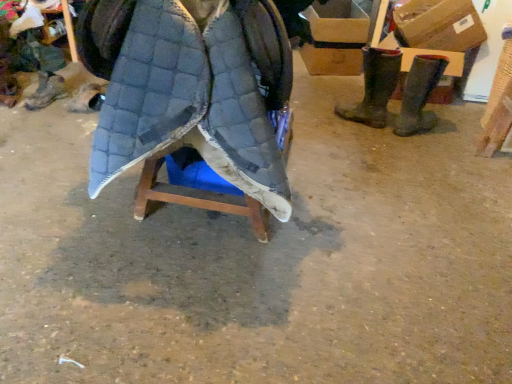
Measure the distance between point (166, 23) and camera.

Answer: Point (166, 23) and camera are 1.09 meters apart.

What are the coordinates of `matte black boot at center, which is the 2th footwear in left-to-right order` in the screenshot? It's located at (87, 98).

What is the approximate width of matte black boot at center, placed as the third footwear when sorted from right to left?

The width of matte black boot at center, placed as the third footwear when sorted from right to left, is 7.79 inches.

Describe the element at coordinates (374, 87) in the screenshot. I see `brown rubber boots at right, the 3th footwear from the left` at that location.

Describe the element at coordinates (419, 95) in the screenshot. The width and height of the screenshot is (512, 384). I see `brown suede boots at right, which ranks as the first footwear in right-to-left order` at that location.

You are a GUI agent. You are given a task and a screenshot of the screen. Output one action in this format:
    pyautogui.click(x=<x>, y=<y>)
    Task: Click on the leather boot at lower left, acting as the 4th footwear starting from the right
    The width and height of the screenshot is (512, 384).
    Given the screenshot: What is the action you would take?
    pyautogui.click(x=46, y=91)

Who is more distant, quilted fabric cloak at center or cardboard box at upper right, the 2th cardboard box from the left?

cardboard box at upper right, the 2th cardboard box from the left, is more distant.

What's the angular difference between quilted fabric cloak at center and cardboard box at upper right, which ranks as the first cardboard box in front-to-back order,'s facing directions?

86 degrees separate the facing orientations of quilted fabric cloak at center and cardboard box at upper right, which ranks as the first cardboard box in front-to-back order.

Does point (247, 161) lie in front of point (454, 38)?

Yes, it is in front of point (454, 38).

Identify the location of cloak located on the left of cardboard box at upper right, which ranks as the first cardboard box in front-to-back order. (191, 88).

Which object is thinner, brown rubber boots at right, the 3th footwear from the left, or brown suede boots at right, which ranks as the first footwear in right-to-left order?

Thinner between the two is brown rubber boots at right, the 3th footwear from the left.

Looking at the image, does brown rubber boots at right, arranged as the second footwear when viewed from the right, seem bigger or smaller compared to brown suede boots at right, which ranks as the first footwear in right-to-left order?

In the image, brown rubber boots at right, arranged as the second footwear when viewed from the right, appears to be larger than brown suede boots at right, which ranks as the first footwear in right-to-left order.

Could you tell me if brown rubber boots at right, the 3th footwear from the left, is facing brown suede boots at right, which ranks as the first footwear in right-to-left order?

No, brown rubber boots at right, the 3th footwear from the left, does not turn towards brown suede boots at right, which ranks as the first footwear in right-to-left order.

Is brown rubber boots at right, arranged as the second footwear when viewed from the right, to the left or to the right of brown suede boots at right, which ranks as the first footwear in right-to-left order, in the image?

In the image, brown rubber boots at right, arranged as the second footwear when viewed from the right, appears on the left side of brown suede boots at right, which ranks as the first footwear in right-to-left order.

Is quilted fabric cloak at center taller than brown suede boots at right, acting as the fourth footwear starting from the left?

Indeed, quilted fabric cloak at center has a greater height compared to brown suede boots at right, acting as the fourth footwear starting from the left.

Is quilted fabric cloak at center positioned behind brown suede boots at right, which ranks as the first footwear in right-to-left order?

No, quilted fabric cloak at center is in front of brown suede boots at right, which ranks as the first footwear in right-to-left order.

From the picture: Between quilted fabric cloak at center and brown suede boots at right, which ranks as the first footwear in right-to-left order, which one has larger width?

With larger width is quilted fabric cloak at center.

Locate an element on the screen. footwear that is the 2nd one when counting leftward from the brown suede boots at right, which ranks as the first footwear in right-to-left order is located at coordinates (87, 98).

Considering the relative sizes of brown suede boots at right, which ranks as the first footwear in right-to-left order, and matte black boot at center, which is the 2th footwear in left-to-right order, in the image provided, is brown suede boots at right, which ranks as the first footwear in right-to-left order, wider than matte black boot at center, which is the 2th footwear in left-to-right order,?

Yes.

Is brown suede boots at right, which ranks as the first footwear in right-to-left order, inside the boundaries of matte black boot at center, which is the 2th footwear in left-to-right order, or outside?

brown suede boots at right, which ranks as the first footwear in right-to-left order, cannot be found inside matte black boot at center, which is the 2th footwear in left-to-right order.

Which object is closer to the camera, brown suede boots at right, acting as the fourth footwear starting from the left, or matte black boot at center, placed as the third footwear when sorted from right to left?

brown suede boots at right, acting as the fourth footwear starting from the left, is closer to the camera.

From a real-world perspective, is cardboard box at upper right, placed as the 2th cardboard box when sorted from back to front, on top of cardboard box at upper right, positioned as the first cardboard box in left-to-right order?

Correct, in the physical world, cardboard box at upper right, placed as the 2th cardboard box when sorted from back to front, is higher than cardboard box at upper right, positioned as the first cardboard box in left-to-right order.

The height and width of the screenshot is (384, 512). What are the coordinates of `cardboard box located below the cardboard box at upper right, positioned as the first cardboard box in left-to-right order (from the image's perspective)` in the screenshot? It's located at (439, 25).

Does point (404, 22) come farther from viewer compared to point (349, 2)?

That is False.

Considering the sizes of objects cardboard box at upper right, which appears as the 1th cardboard box when viewed from the back, and leather boot at lower left, the first footwear from the left, in the image provided, who is thinner, cardboard box at upper right, which appears as the 1th cardboard box when viewed from the back, or leather boot at lower left, the first footwear from the left,?

leather boot at lower left, the first footwear from the left, is thinner.

Considering the sizes of objects cardboard box at upper right, arranged as the second cardboard box when viewed from the front, and leather boot at lower left, acting as the 4th footwear starting from the right, in the image provided, who is shorter, cardboard box at upper right, arranged as the second cardboard box when viewed from the front, or leather boot at lower left, acting as the 4th footwear starting from the right,?

leather boot at lower left, acting as the 4th footwear starting from the right, is shorter.

Choose the correct answer: Is cardboard box at upper right, positioned as the first cardboard box in left-to-right order, inside leather boot at lower left, the first footwear from the left, or outside it?

cardboard box at upper right, positioned as the first cardboard box in left-to-right order, is not enclosed by leather boot at lower left, the first footwear from the left.

Is cardboard box at upper right, which appears as the 1th cardboard box when viewed from the back, far from leather boot at lower left, acting as the 4th footwear starting from the right?

That's right, there is a large distance between cardboard box at upper right, which appears as the 1th cardboard box when viewed from the back, and leather boot at lower left, acting as the 4th footwear starting from the right.

Is quilted fabric cloak at center facing away from brown rubber boots at right, arranged as the second footwear when viewed from the right?

Correct, quilted fabric cloak at center is looking away from brown rubber boots at right, arranged as the second footwear when viewed from the right.

Which is farther, (x=288, y=189) or (x=385, y=82)?

Positioned behind is point (x=385, y=82).

The height and width of the screenshot is (384, 512). Identify the location of cloak on the left of brown rubber boots at right, the 3th footwear from the left. (191, 88).

From a real-world perspective, which object stands above the other?

quilted fabric cloak at center, from a real-world perspective.

In order to click on cloak in front of the cardboard box at upper right, which is counted as the 1th cardboard box, starting from the right in this screenshot , I will do `click(191, 88)`.

You are a GUI agent. You are given a task and a screenshot of the screen. Output one action in this format:
    pyautogui.click(x=<x>, y=<y>)
    Task: Click on the 2nd footwear above the brown suede boots at right, which ranks as the first footwear in right-to-left order (from the image's perspective)
    Image resolution: width=512 pixels, height=384 pixels.
    Given the screenshot: What is the action you would take?
    pyautogui.click(x=374, y=87)

Which object lies further to the anchor point cardboard box at upper right, arranged as the second cardboard box when viewed from the front, brown rubber boots at right, the 3th footwear from the left, or cardboard box at upper right, placed as the 2th cardboard box when sorted from back to front?

brown rubber boots at right, the 3th footwear from the left.

From the image, which object appears to be nearer to brown suede boots at right, which ranks as the first footwear in right-to-left order, cardboard box at upper right, which is counted as the 1th cardboard box, starting from the right, or leather boot at lower left, acting as the 4th footwear starting from the right?

Among the two, cardboard box at upper right, which is counted as the 1th cardboard box, starting from the right, is located nearer to brown suede boots at right, which ranks as the first footwear in right-to-left order.

Based on their spatial positions, is leather boot at lower left, the first footwear from the left, or brown rubber boots at right, the 3th footwear from the left, closer to brown suede boots at right, acting as the fourth footwear starting from the left?

brown rubber boots at right, the 3th footwear from the left, is closer to brown suede boots at right, acting as the fourth footwear starting from the left.

Estimate the real-world distances between objects in this image. Which object is closer to brown rubber boots at right, the 3th footwear from the left, cardboard box at upper right, the 2th cardboard box from the left, or cardboard box at upper right, positioned as the first cardboard box in left-to-right order?

Among the two, cardboard box at upper right, the 2th cardboard box from the left, is located nearer to brown rubber boots at right, the 3th footwear from the left.

From the image, which object appears to be nearer to brown suede boots at right, which ranks as the first footwear in right-to-left order, cardboard box at upper right, placed as the 2th cardboard box when sorted from back to front, or matte black boot at center, placed as the third footwear when sorted from right to left?

Among the two, cardboard box at upper right, placed as the 2th cardboard box when sorted from back to front, is located nearer to brown suede boots at right, which ranks as the first footwear in right-to-left order.

Looking at the image, which one is located further to matte black boot at center, which is the 2th footwear in left-to-right order, cardboard box at upper right, positioned as the first cardboard box in left-to-right order, or leather boot at lower left, acting as the 4th footwear starting from the right?

cardboard box at upper right, positioned as the first cardboard box in left-to-right order, is further to matte black boot at center, which is the 2th footwear in left-to-right order.

From the image, which object appears to be farther from cardboard box at upper right, arranged as the second cardboard box when viewed from the front, leather boot at lower left, acting as the 4th footwear starting from the right, or brown suede boots at right, which ranks as the first footwear in right-to-left order?

leather boot at lower left, acting as the 4th footwear starting from the right, is positioned further to the anchor cardboard box at upper right, arranged as the second cardboard box when viewed from the front.

Based on their spatial positions, is quilted fabric cloak at center or cardboard box at upper right, arranged as the second cardboard box when viewed from the front, further from cardboard box at upper right, which is counted as the 1th cardboard box, starting from the right?

quilted fabric cloak at center.

This screenshot has height=384, width=512. I want to click on cardboard box between leather boot at lower left, acting as the 4th footwear starting from the right, and brown rubber boots at right, arranged as the second footwear when viewed from the right, so click(337, 22).

Locate an element on the screen. cardboard box between matte black boot at center, which is the 2th footwear in left-to-right order, and brown rubber boots at right, the 3th footwear from the left, in the horizontal direction is located at coordinates (337, 22).

Locate an element on the screen. cloak between matte black boot at center, which is the 2th footwear in left-to-right order, and cardboard box at upper right, placed as the 2th cardboard box when sorted from back to front, in the horizontal direction is located at coordinates (191, 88).

Image resolution: width=512 pixels, height=384 pixels. In order to click on cloak situated between leather boot at lower left, the first footwear from the left, and cardboard box at upper right, which is counted as the 1th cardboard box, starting from the right, from left to right in this screenshot , I will do `click(191, 88)`.